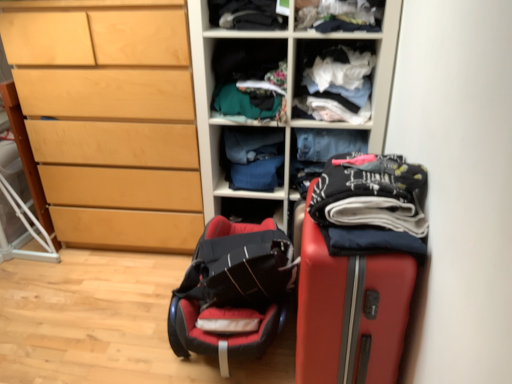
Question: In terms of width, does printed cotton pants at right, which appears as the 1th clothing when viewed from the front, look wider or thinner when compared to blue fabric at center, which appears as the 1th clothing when viewed from the back?

Choices:
 (A) wide
 (B) thin

Answer: (A)

Question: Looking at the image, does printed cotton pants at right, the 5th clothing from the back, seem bigger or smaller compared to blue fabric at center, which appears as the 1th clothing when viewed from the back?

Choices:
 (A) small
 (B) big

Answer: (B)

Question: Which is nearer to the rubberized red suitcase at right?

Choices:
 (A) blue fabric at center, which appears as the 1th clothing when viewed from the back
 (B) white fabric at upper center, which is the second shelf in left-to-right order
 (C) printed cotton pants at right, the 5th clothing from the back
 (D) dark blue cotton pants at center, which is counted as the 4th clothing, starting from the front
 (E) textured fabric clothes at center, which is counted as the 2th shelf, starting from the right

Answer: (C)

Question: Based on their relative distances, which object is farther from the dark gray fabric at upper center, positioned as the 3th clothing in back-to-front order?

Choices:
 (A) printed cotton pants at right, which appears as the 1th clothing when viewed from the front
 (B) textured fabric clothes at center, which appears as the first shelf when viewed from the left
 (C) light wood chest of drawers at left
 (D) wooden shelves at center
 (E) white fabric at upper center, positioned as the first shelf in right-to-left order

Answer: (A)